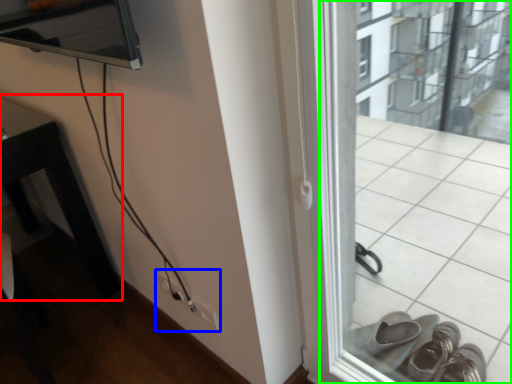
Question: Considering the real-world distances, which object is closest to table (highlighted by a red box)? electric outlet (highlighted by a blue box) or window frame (highlighted by a green box).

Choices:
 (A) electric outlet
 (B) window frame

Answer: (A)